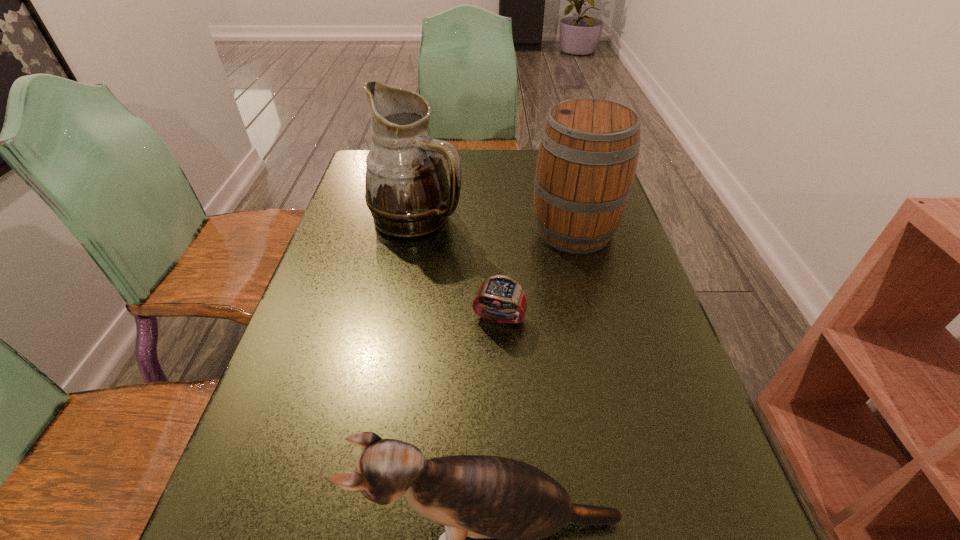
The image size is (960, 540). Find the location of `vacant space at the right edge of the desktop`. vacant space at the right edge of the desktop is located at coordinates (657, 383).

This screenshot has height=540, width=960. I want to click on empty space that is in between the second nearest object and the pitcher, so click(x=459, y=268).

I want to click on empty location between the shortest object and the pitcher, so click(459, 268).

This screenshot has width=960, height=540. In order to click on vacant point located between the cider and the pitcher in this screenshot , I will do `click(495, 224)`.

This screenshot has width=960, height=540. Find the location of `vacant area that lies between the pitcher and the cider`. vacant area that lies between the pitcher and the cider is located at coordinates (495, 224).

Locate an element on the screen. This screenshot has height=540, width=960. blank region between the cider and the pitcher is located at coordinates (495, 224).

This screenshot has height=540, width=960. I want to click on object that stands as the closest to the cat, so click(x=499, y=292).

Identify which object is the nearest to the nearest object. Please provide its 2D coordinates. Your answer should be formatted as a tuple, i.e. [(x, y)], where the tuple contains the x and y coordinates of a point satisfying the conditions above.

[(499, 292)]

Identify the location of blank space that satisfies the following two spatial constraints: 1. from the spout of the cider; 2. on the left side of the pitcher. Image resolution: width=960 pixels, height=540 pixels. (416, 230).

Where is `vacant point that satisfies the following two spatial constraints: 1. from the spout of the pitcher; 2. on the right side of the watch`? vacant point that satisfies the following two spatial constraints: 1. from the spout of the pitcher; 2. on the right side of the watch is located at coordinates (399, 319).